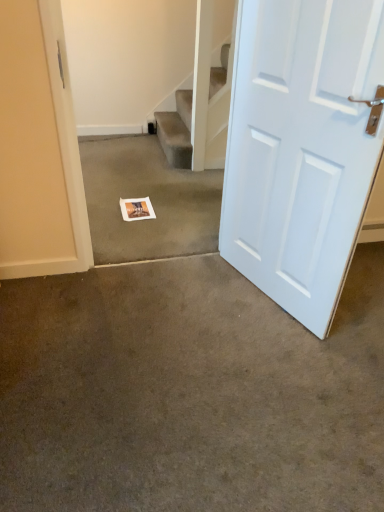
Question: Is white paper at center, the 1th concrete viewed from the top, taller or shorter than white matte door at right?

Choices:
 (A) short
 (B) tall

Answer: (A)

Question: From the image's perspective, is white paper at center, the 1th concrete viewed from the top, positioned above or below white matte door at right?

Choices:
 (A) below
 (B) above

Answer: (B)

Question: Which is farther from the brown carpet at center, arranged as the 2th concrete when viewed from the top?

Choices:
 (A) white matte door at right
 (B) white paper at center, which appears as the 2th concrete when viewed from the front
 (C) white paper postcard at center

Answer: (C)

Question: Considering the real-world distances, which object is farthest from the brown carpet at center, arranged as the second concrete when viewed from the back?

Choices:
 (A) white paper postcard at center
 (B) white matte door at right
 (C) white paper at center, the 2th concrete positioned from the bottom

Answer: (A)